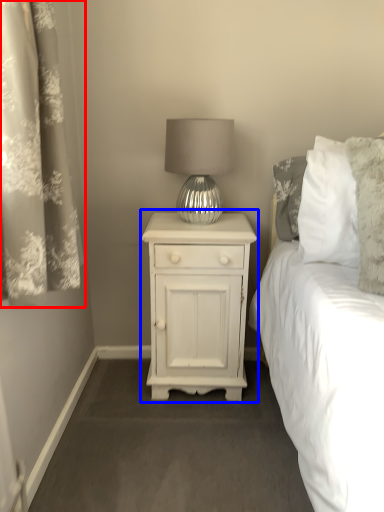
Question: Which object is further to the camera taking this photo, curtain (highlighted by a red box) or nightstand (highlighted by a blue box)?

Choices:
 (A) curtain
 (B) nightstand

Answer: (B)